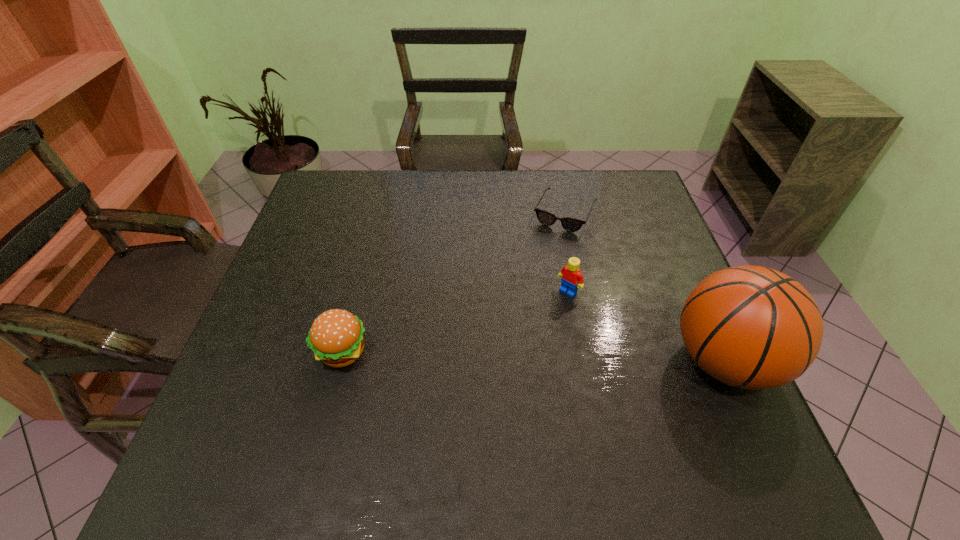
The height and width of the screenshot is (540, 960). Identify the location of unoccupied position between the sunglasses and the leftmost object. (453, 282).

This screenshot has height=540, width=960. Find the location of `empty location between the hamburger and the sunglasses`. empty location between the hamburger and the sunglasses is located at coordinates (453, 282).

The width and height of the screenshot is (960, 540). Identify the location of vacant region between the basketball and the third nearest object. (646, 326).

Find the location of a particular element. empty space between the basketball and the farthest object is located at coordinates (644, 287).

This screenshot has width=960, height=540. I want to click on vacant space in between the sunglasses and the hamburger, so click(453, 282).

Identify which object is the third nearest to the third nearest object. Please provide its 2D coordinates. Your answer should be formatted as a tuple, i.e. [(x, y)], where the tuple contains the x and y coordinates of a point satisfying the conditions above.

[(336, 337)]

The image size is (960, 540). I want to click on object that is the nearest to the hamburger, so click(x=571, y=278).

At what (x,y) coordinates should I click in order to perform the action: click on vacant space that satisfies the following two spatial constraints: 1. on the front side of the rightmost object; 2. on the left side of the shortest object. Please return your answer as a coordinate pair (x, y). The height and width of the screenshot is (540, 960). Looking at the image, I should click on (597, 361).

Find the location of a particular element. The image size is (960, 540). free space that satisfies the following two spatial constraints: 1. on the front side of the tallest object; 2. on the right side of the hamburger is located at coordinates (340, 361).